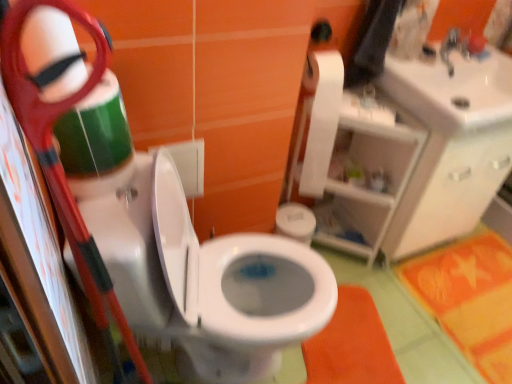
Question: From a real-world perspective, is white matte toilet paper at upper right positioned under orange fabric bath mat at lower center, which is the first bath mat in left-to-right order, based on gravity?

Choices:
 (A) yes
 (B) no

Answer: (B)

Question: Considering the relative sizes of white matte toilet paper at upper right and orange fabric bath mat at lower center, the second bath mat viewed from the right, in the image provided, is white matte toilet paper at upper right shorter than orange fabric bath mat at lower center, the second bath mat viewed from the right,?

Choices:
 (A) yes
 (B) no

Answer: (B)

Question: Considering the relative sizes of white matte toilet paper at upper right and orange fabric bath mat at lower center, which is the first bath mat in left-to-right order, in the image provided, is white matte toilet paper at upper right taller than orange fabric bath mat at lower center, which is the first bath mat in left-to-right order,?

Choices:
 (A) no
 (B) yes

Answer: (B)

Question: Is white matte toilet paper at upper right facing towards orange fabric bath mat at lower center, the second bath mat viewed from the right?

Choices:
 (A) no
 (B) yes

Answer: (A)

Question: Considering the relative sizes of white matte toilet paper at upper right and orange fabric bath mat at lower center, the second bath mat viewed from the right, in the image provided, is white matte toilet paper at upper right thinner than orange fabric bath mat at lower center, the second bath mat viewed from the right,?

Choices:
 (A) yes
 (B) no

Answer: (A)

Question: Looking at their shapes, would you say white glossy sink at upper right is wider or thinner than orange fabric bath mat at lower center, which is the first bath mat in left-to-right order?

Choices:
 (A) wide
 (B) thin

Answer: (B)

Question: Considering their positions, is white glossy sink at upper right located in front of or behind orange fabric bath mat at lower center, which is the first bath mat in left-to-right order?

Choices:
 (A) behind
 (B) front

Answer: (B)

Question: Looking at the image, does white glossy sink at upper right seem bigger or smaller compared to orange fabric bath mat at lower center, the second bath mat viewed from the right?

Choices:
 (A) small
 (B) big

Answer: (B)

Question: Visually, is white glossy sink at upper right positioned to the left or to the right of orange fabric bath mat at lower center, which is the first bath mat in left-to-right order?

Choices:
 (A) right
 (B) left

Answer: (A)

Question: Considering their positions, is orange/yellow fabric bath mat at lower right, the 2th bath mat from the left, located in front of or behind white plastic shelf at upper right?

Choices:
 (A) behind
 (B) front

Answer: (A)

Question: Would you say orange/yellow fabric bath mat at lower right, the first bath mat positioned from the right, is inside or outside white plastic shelf at upper right?

Choices:
 (A) outside
 (B) inside

Answer: (A)

Question: From a real-world perspective, relative to white plastic shelf at upper right, is orange/yellow fabric bath mat at lower right, the 2th bath mat from the left, vertically above or below?

Choices:
 (A) above
 (B) below

Answer: (B)

Question: In terms of height, does orange/yellow fabric bath mat at lower right, the first bath mat positioned from the right, look taller or shorter compared to white plastic shelf at upper right?

Choices:
 (A) short
 (B) tall

Answer: (A)

Question: Considering the relative positions of white matte toilet paper at upper right and orange fabric bath mat at lower center, which is the first bath mat in left-to-right order, in the image provided, is white matte toilet paper at upper right to the left or to the right of orange fabric bath mat at lower center, which is the first bath mat in left-to-right order,?

Choices:
 (A) left
 (B) right

Answer: (A)

Question: Considering their positions, is white matte toilet paper at upper right located in front of or behind orange fabric bath mat at lower center, the second bath mat viewed from the right?

Choices:
 (A) behind
 (B) front

Answer: (B)